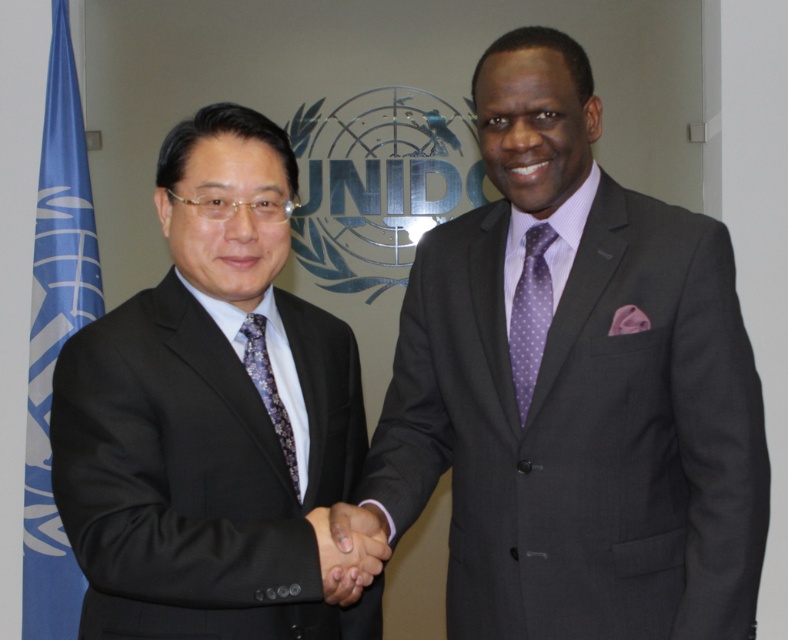
You are a photographer at the UNIDO event. You need to capture a closeup shot of both the dark gray suit at center and the purple dotted fabric tie at right in a single frame. Given the camera you have can only focus on objects within 6 inches of each other, will you be able to do this?

The dark gray suit at center is 6.68 inches away from the purple dotted fabric tie at right. Since the camera can only focus on objects within 6 inches of each other, the distance between them exceeds the camera s focusing range. Therefore, you won t be able to capture both in sharp focus in a single frame.

What is located at the coordinates point (x=54, y=333) in the image?

The blue fabric flag at left is located at point (x=54, y=333).

You are standing in front of a UNIDO event photo. There is a point at coordinates point (619, 464). If you want to touch this point with a 1.5 meter long stick, can you reach it?

The point (619, 464) is 1.42 meters away from the camera, so yes, you can reach it with a 1.5 meter long stick since it is slightly shorter than the stick.